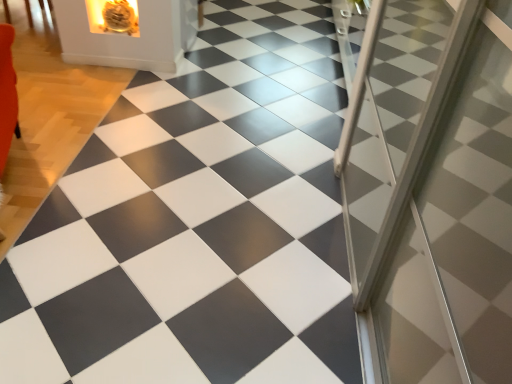
Question: Is clear glass screen door at right looking in the opposite direction of gold metallic fireplace at upper left?

Choices:
 (A) no
 (B) yes

Answer: (A)

Question: Is clear glass screen door at right positioned in front of gold metallic fireplace at upper left?

Choices:
 (A) no
 (B) yes

Answer: (B)

Question: Is clear glass screen door at right thinner than gold metallic fireplace at upper left?

Choices:
 (A) no
 (B) yes

Answer: (A)

Question: Is gold metallic fireplace at upper left surrounded by clear glass screen door at right?

Choices:
 (A) no
 (B) yes

Answer: (A)

Question: Does clear glass screen door at right have a larger size compared to gold metallic fireplace at upper left?

Choices:
 (A) no
 (B) yes

Answer: (B)

Question: Is clear glass screen door at right taller than gold metallic fireplace at upper left?

Choices:
 (A) yes
 (B) no

Answer: (A)

Question: From a real-world perspective, is gold metallic fireplace at upper left positioned over clear glass screen door at right based on gravity?

Choices:
 (A) yes
 (B) no

Answer: (B)

Question: Is gold metallic fireplace at upper left at the left side of clear glass screen door at right?

Choices:
 (A) yes
 (B) no

Answer: (A)

Question: Does gold metallic fireplace at upper left have a lesser width compared to clear glass screen door at right?

Choices:
 (A) no
 (B) yes

Answer: (B)

Question: Does gold metallic fireplace at upper left turn towards clear glass screen door at right?

Choices:
 (A) yes
 (B) no

Answer: (B)

Question: Is gold metallic fireplace at upper left not inside clear glass screen door at right?

Choices:
 (A) no
 (B) yes

Answer: (B)

Question: Does gold metallic fireplace at upper left touch clear glass screen door at right?

Choices:
 (A) no
 (B) yes

Answer: (A)

Question: Considering their positions, is gold metallic fireplace at upper left located in front of or behind clear glass screen door at right?

Choices:
 (A) behind
 (B) front

Answer: (A)